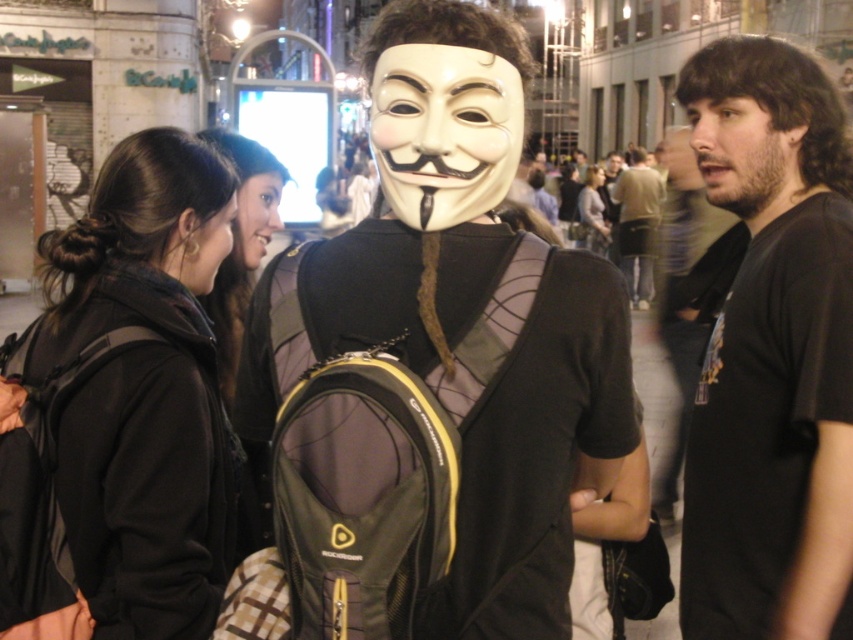
Question: Is matte black backpack at center further to camera compared to dark brown leather jacket at center?

Choices:
 (A) yes
 (B) no

Answer: (B)

Question: Is smooth skin face at center positioned in front of matte gray hoodie at center?

Choices:
 (A) no
 (B) yes

Answer: (B)

Question: Does smooth skin face at center appear over matte gray hoodie at center?

Choices:
 (A) yes
 (B) no

Answer: (B)

Question: Which of the following is the closest to the observer?

Choices:
 (A) black matte t-shirt at right
 (B) matte skin at center
 (C) bearded man at center
 (D) dark brown leather jacket at center

Answer: (A)

Question: Which point is farther from the camera taking this photo?

Choices:
 (A) (514, 156)
 (B) (410, 557)
 (C) (595, 184)

Answer: (C)

Question: Which of the following is the farthest from the observer?

Choices:
 (A) black fabric jacket at left
 (B) dark brown hair at center
 (C) bearded man at center
 (D) black matte t-shirt at right

Answer: (C)